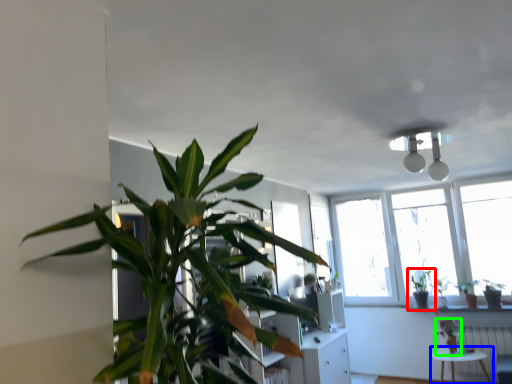
Question: Which object is the closest to the houseplant (highlighted by a red box)? Choose among these: table (highlighted by a blue box) or houseplant (highlighted by a green box).

Choices:
 (A) table
 (B) houseplant

Answer: (B)